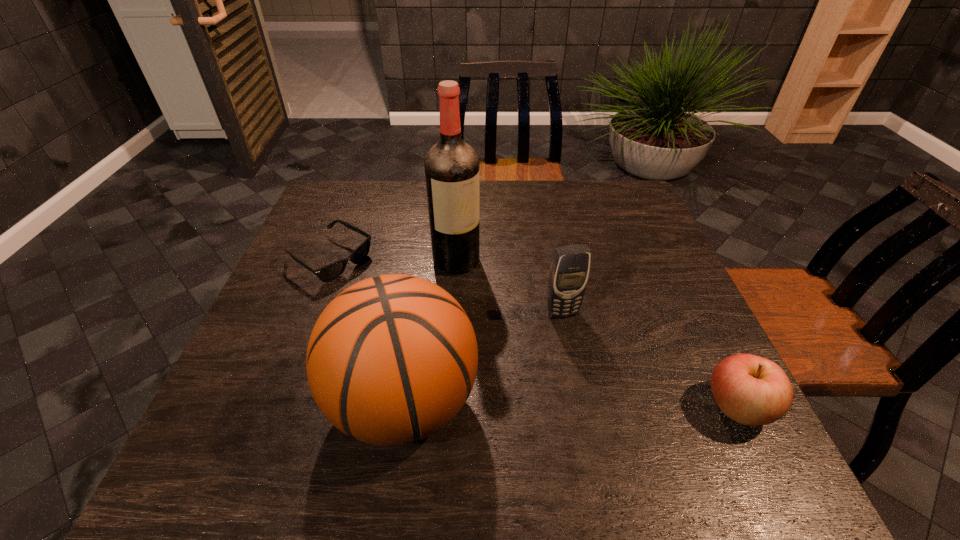
At what (x,y) coordinates should I click in order to perform the action: click on vacant space that satisfies the following two spatial constraints: 1. on the back side of the cellular telephone; 2. on the right side of the basketball. Please return your answer as a coordinate pair (x, y). Image resolution: width=960 pixels, height=540 pixels. Looking at the image, I should click on (417, 313).

The height and width of the screenshot is (540, 960). Find the location of `free space that satisfies the following two spatial constraints: 1. on the front side of the third nearest object; 2. on the right side of the shortest object`. free space that satisfies the following two spatial constraints: 1. on the front side of the third nearest object; 2. on the right side of the shortest object is located at coordinates (309, 313).

What are the coordinates of `free location that satisfies the following two spatial constraints: 1. on the front side of the shortest object; 2. on the left side of the cellular telephone` in the screenshot? It's located at (309, 313).

This screenshot has width=960, height=540. Find the location of `free spot that satisfies the following two spatial constraints: 1. on the front side of the third shortest object; 2. on the right side of the sunglasses`. free spot that satisfies the following two spatial constraints: 1. on the front side of the third shortest object; 2. on the right side of the sunglasses is located at coordinates (309, 313).